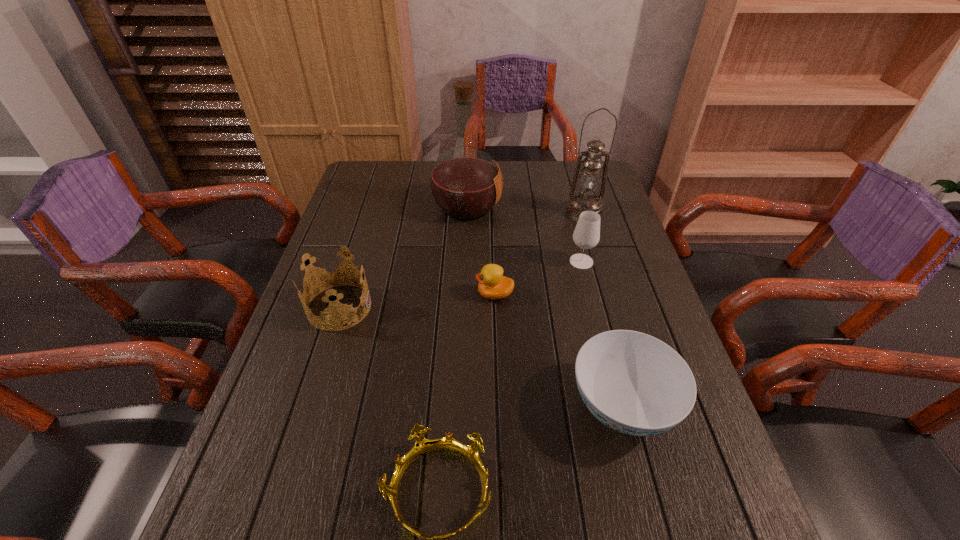
What are the coordinates of `vacant space that satisfies the following two spatial constraints: 1. on the face of the second shortest object; 2. on the front side of the left crown` in the screenshot? It's located at (495, 307).

The width and height of the screenshot is (960, 540). Find the location of `free space in the image that satisfies the following two spatial constraints: 1. on the back side of the chinaware; 2. on the face of the duckling`. free space in the image that satisfies the following two spatial constraints: 1. on the back side of the chinaware; 2. on the face of the duckling is located at coordinates (592, 294).

Identify the location of vacant region that satisfies the following two spatial constraints: 1. on the back side of the chinaware; 2. on the front label of the liquor. (569, 207).